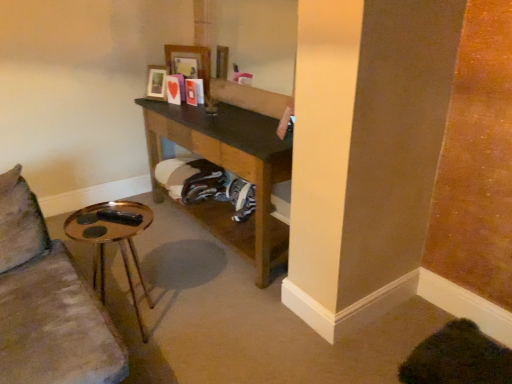
Where is `vacant area that lies to the right of gold metallic side table at lower left`? The height and width of the screenshot is (384, 512). vacant area that lies to the right of gold metallic side table at lower left is located at coordinates (199, 327).